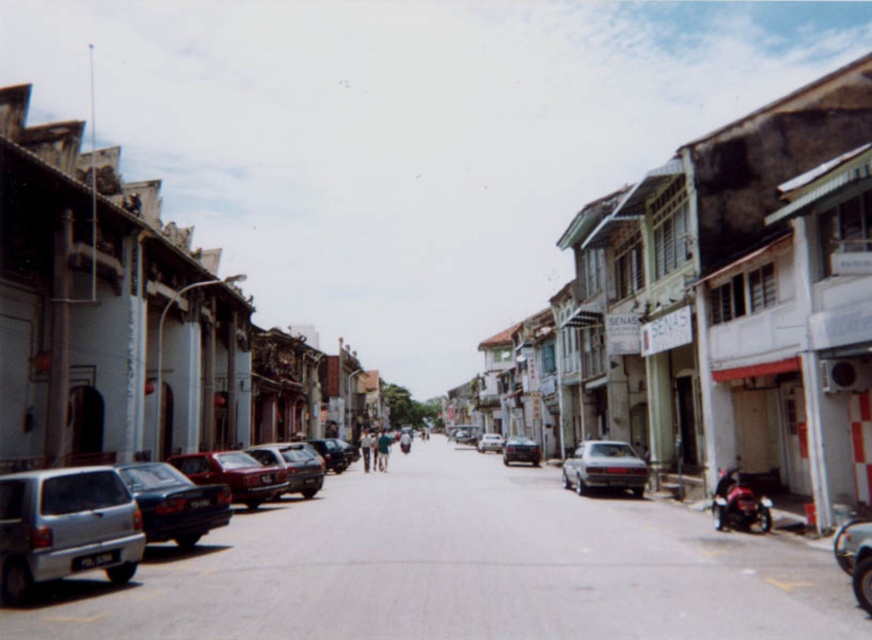
Can you confirm if silver metallic car at lower left is wider than shiny red motorbike at right?

Yes.

Is point (100, 476) positioned behind point (753, 492)?

No, (100, 476) is closer to viewer.

Where is `silver metallic car at lower left`? The width and height of the screenshot is (872, 640). silver metallic car at lower left is located at coordinates (65, 528).

Looking at this image, who is positioned more to the right, silver metallic car at lower left or shiny dark blue sedan at center-left?

shiny dark blue sedan at center-left is more to the right.

The height and width of the screenshot is (640, 872). What do you see at coordinates (65, 528) in the screenshot?
I see `silver metallic car at lower left` at bounding box center [65, 528].

Is point (94, 561) less distant than point (126, 465)?

That is True.

Where is `silver metallic car at lower left`? silver metallic car at lower left is located at coordinates (65, 528).

Is point (187, 458) more distant than point (491, 449)?

That is False.

Which is behind, point (201, 461) or point (496, 436)?

The point (496, 436) is behind.

The width and height of the screenshot is (872, 640). Find the location of `shiny red car at left`. shiny red car at left is located at coordinates (233, 474).